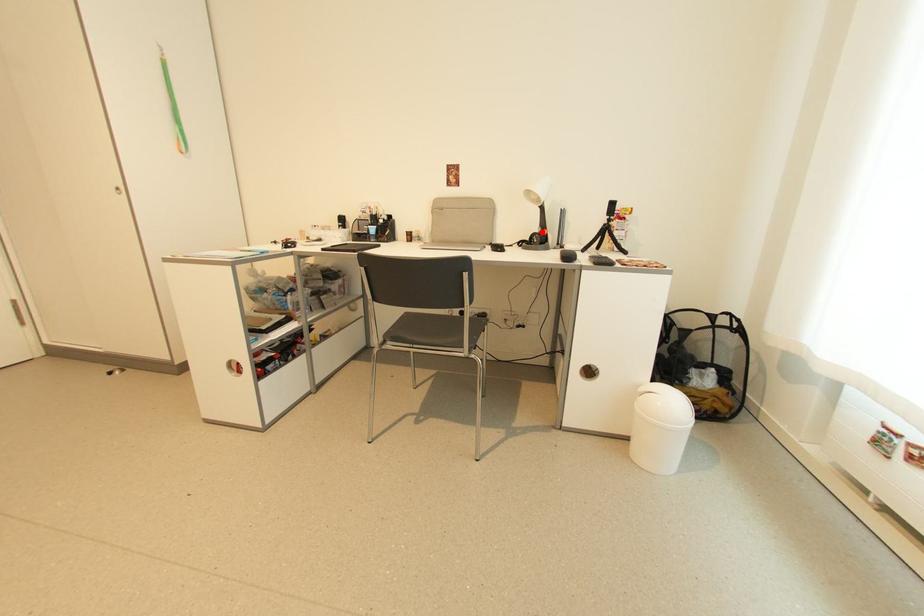
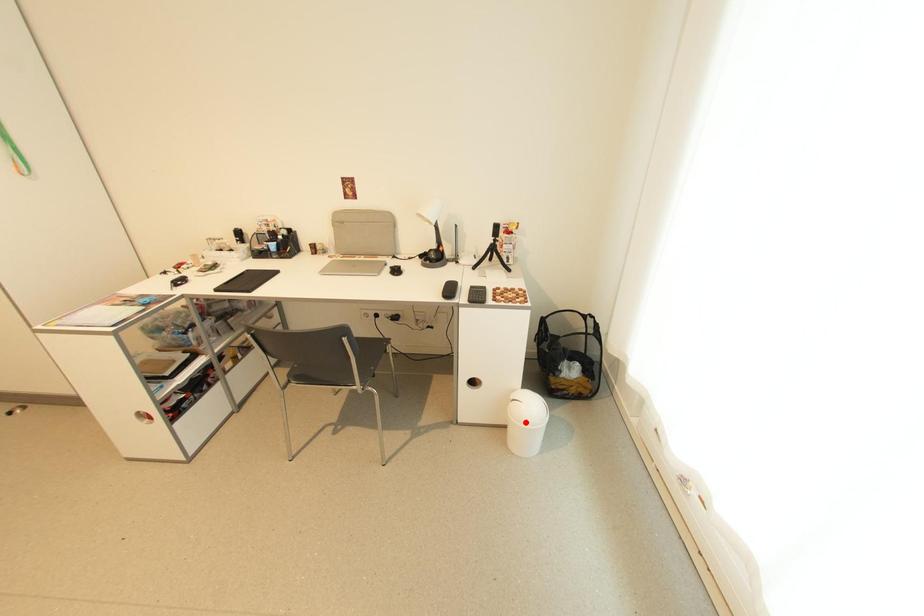
I am providing you with two images of the same scene from different viewpoints. A red point is marked on the first image and another point is marked on the second image. Does the point marked in image1 correspond to the same location as the one in image2?

No